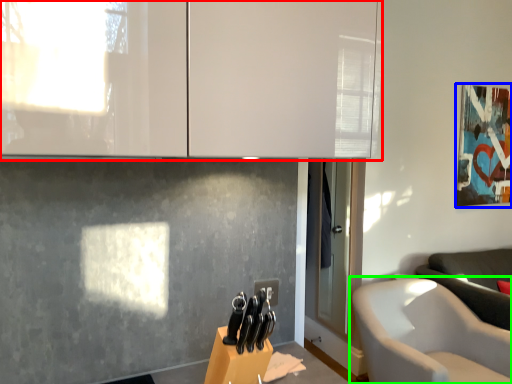
Question: Which object is positioned farthest from cabinetry (highlighted by a red box)? Select from picture frame (highlighted by a blue box) and chair (highlighted by a green box).

Choices:
 (A) picture frame
 (B) chair

Answer: (A)